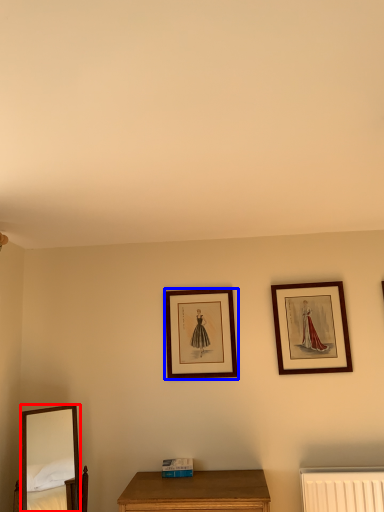
Question: Which point is further to the camera, mirror (highlighted by a red box) or picture frame (highlighted by a blue box)?

Choices:
 (A) mirror
 (B) picture frame

Answer: (B)